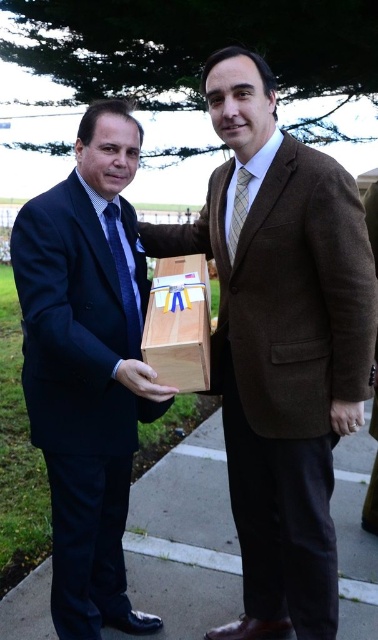
This screenshot has width=378, height=640. In order to click on matte wood box at center in this screenshot , I will do (x=86, y=365).

Does matte wood box at center lie behind natural wood box at center?

No.

Between point (125, 157) and point (192, 262), which one is positioned behind?

The point (192, 262) is more distant.

The image size is (378, 640). I want to click on matte wood box at center, so click(x=86, y=365).

Does brown woolen suit at center appear on the right side of natural wood box at center?

Indeed, brown woolen suit at center is positioned on the right side of natural wood box at center.

Between brown woolen suit at center and natural wood box at center, which one is positioned lower?

brown woolen suit at center is lower down.

Who is more distant from viewer, (297, 266) or (198, 269)?

The point (198, 269) is more distant.

Locate an element on the screen. The image size is (378, 640). brown woolen suit at center is located at coordinates (280, 344).

Who is more distant from viewer, (x=156, y=612) or (x=150, y=378)?

The point (x=156, y=612) is behind.

Between smooth concrete pavement at lower center and matte brown wooden box at center, which one has less height?

matte brown wooden box at center

Is point (340, 442) positioned before point (154, 380)?

No, it is not.

At what (x,y) coordinates should I click in order to perform the action: click on smooth concrete pavement at lower center. Please return your answer as a coordinate pair (x, y). The image size is (378, 640). Looking at the image, I should click on (184, 540).